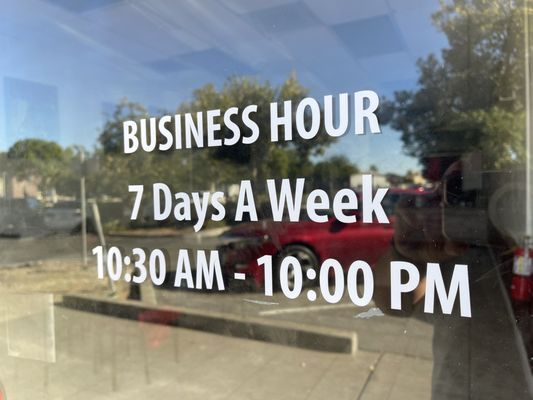
In order to click on ceiling tiles reflected in in window in this screenshot , I will do `click(323, 47)`, `click(332, 11)`, `click(421, 32)`.